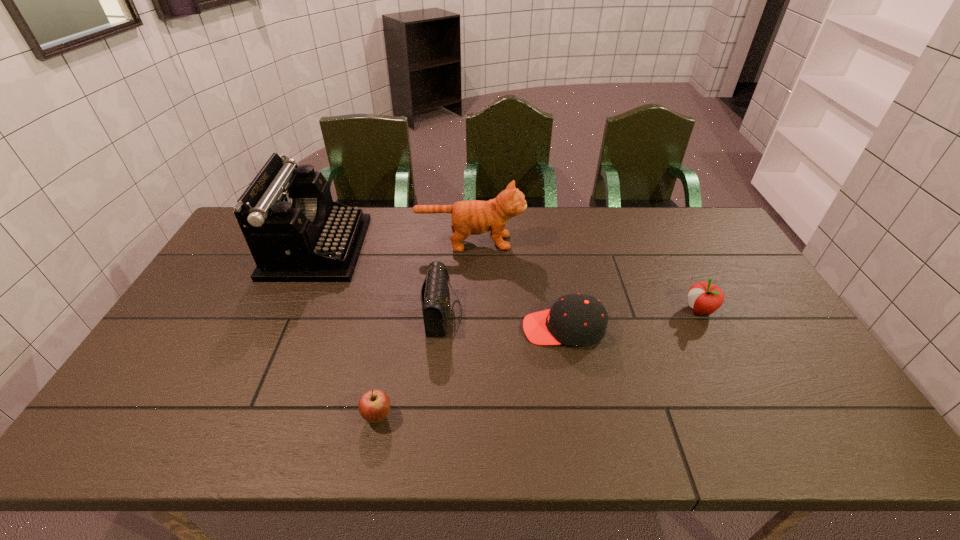
Locate an element on the screen. Image resolution: width=960 pixels, height=540 pixels. free space that satisfies the following two spatial constraints: 1. on the face of the cat; 2. on the front side of the nearer apple is located at coordinates (466, 416).